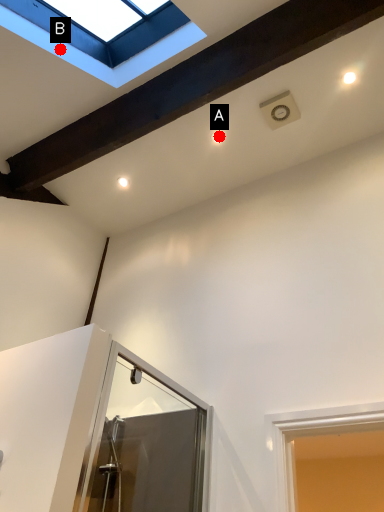
Question: Two points are circled on the image, labeled by A and B beside each circle. Which point appears closest to the camera in this image?

Choices:
 (A) A is closer
 (B) B is closer

Answer: (B)